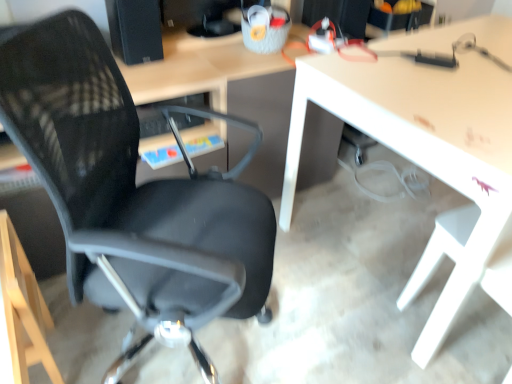
Locate an element on the screen. This screenshot has width=512, height=384. free space below white glossy table at center (from a real-world perspective) is located at coordinates (390, 222).